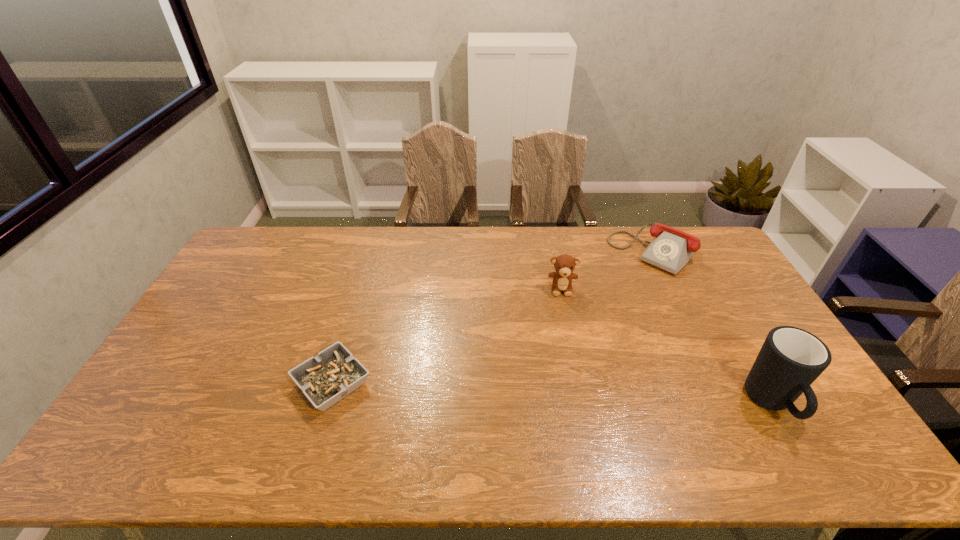
You are a GUI agent. You are given a task and a screenshot of the screen. Output one action in this format:
    pyautogui.click(x=<x>, y=<y>)
    Task: Click on the free spot between the ashtray and the telephone
    The image size is (960, 540).
    Given the screenshot: What is the action you would take?
    pyautogui.click(x=492, y=318)

I want to click on vacant space in between the mug and the third shortest object, so click(x=666, y=347).

Identify the location of vacant space that's between the ashtray and the second shortest object. (492, 318).

Locate an element on the screen. The image size is (960, 540). free area in between the mug and the shortest object is located at coordinates [x=552, y=394].

The image size is (960, 540). I want to click on vacant space in between the ashtray and the teddy bear, so click(447, 336).

Locate an element on the screen. The height and width of the screenshot is (540, 960). empty space that is in between the third tallest object and the leftmost object is located at coordinates (492, 318).

Locate which object is the third closest to the mug. Please provide its 2D coordinates. Your answer should be formatted as a tuple, i.e. [(x, y)], where the tuple contains the x and y coordinates of a point satisfying the conditions above.

[(334, 373)]

Identify the location of object that ranks as the second closest to the telephone. This screenshot has width=960, height=540. tap(791, 359).

Where is `vacant point that satisfies the following two spatial constraints: 1. on the back side of the ashtray; 2. on the right side of the teddy bear`? vacant point that satisfies the following two spatial constraints: 1. on the back side of the ashtray; 2. on the right side of the teddy bear is located at coordinates (361, 288).

Where is `vacant space that satisfies the following two spatial constraints: 1. on the back side of the third object from right to left; 2. on the right side of the leftmost object`? This screenshot has width=960, height=540. vacant space that satisfies the following two spatial constraints: 1. on the back side of the third object from right to left; 2. on the right side of the leftmost object is located at coordinates point(361,288).